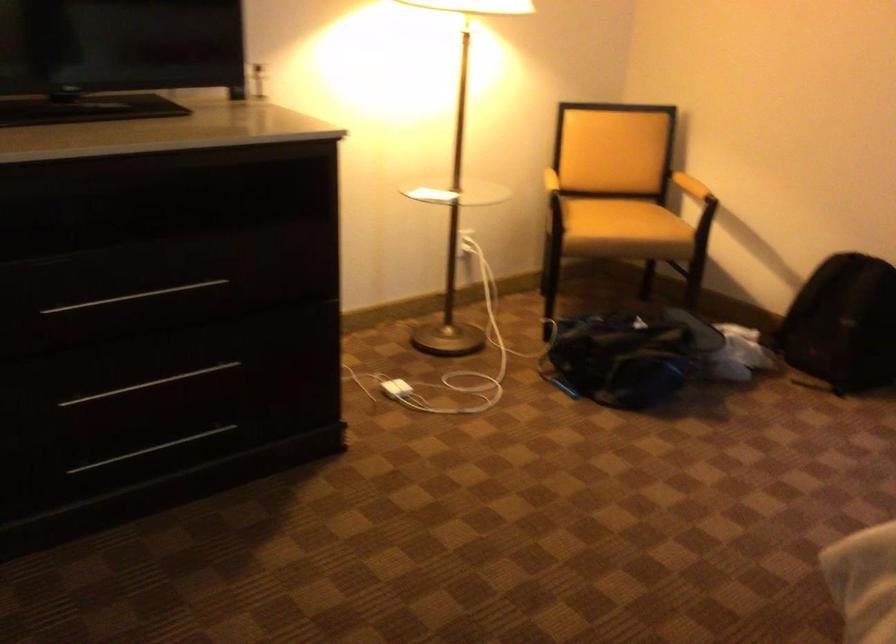
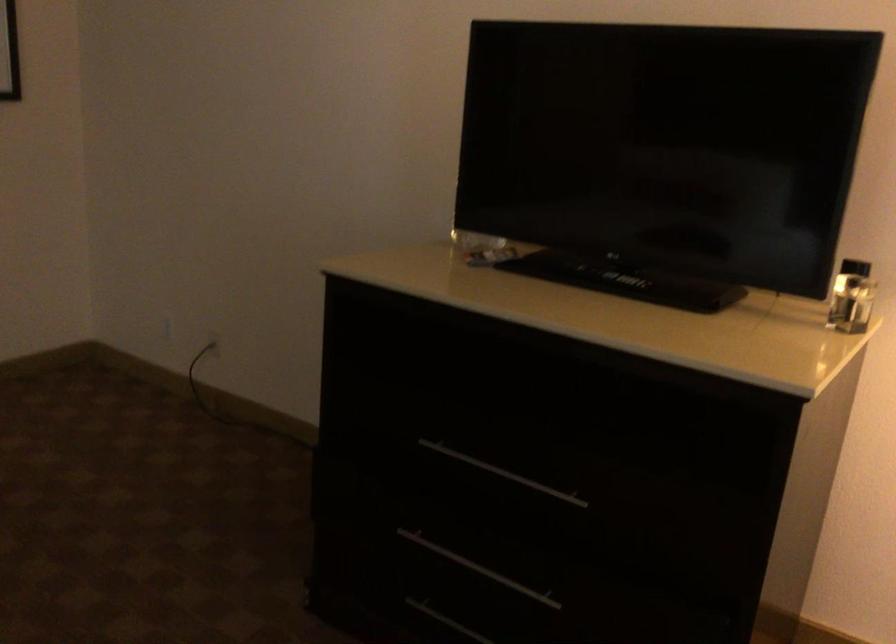
The point at (127, 392) is marked in the first image. Where is the corresponding point in the second image?

(478, 567)